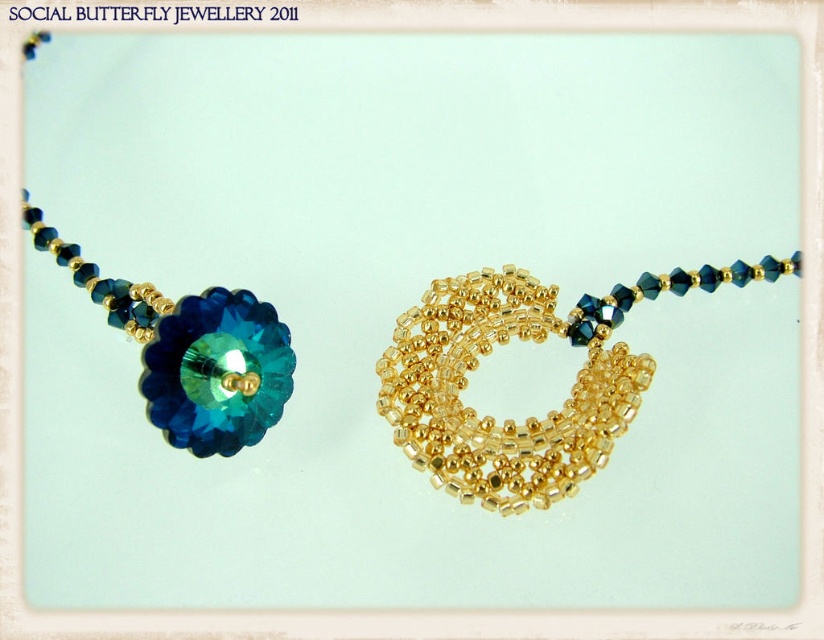
Question: Which object appears farthest from the camera in this image?

Choices:
 (A) teal crystal flower at left
 (B) gold textured beads at center

Answer: (B)

Question: Among these points, which one is farthest from the camera?

Choices:
 (A) (460, 316)
 (B) (225, 436)

Answer: (A)

Question: Is gold textured beads at center to the right of teal crystal flower at left from the viewer's perspective?

Choices:
 (A) no
 (B) yes

Answer: (B)

Question: Can you confirm if gold textured beads at center is positioned below teal crystal flower at left?

Choices:
 (A) yes
 (B) no

Answer: (A)

Question: Does gold textured beads at center have a lesser width compared to teal crystal flower at left?

Choices:
 (A) no
 (B) yes

Answer: (A)

Question: Which object is farther from the camera taking this photo?

Choices:
 (A) gold textured beads at center
 (B) teal crystal flower at left

Answer: (A)